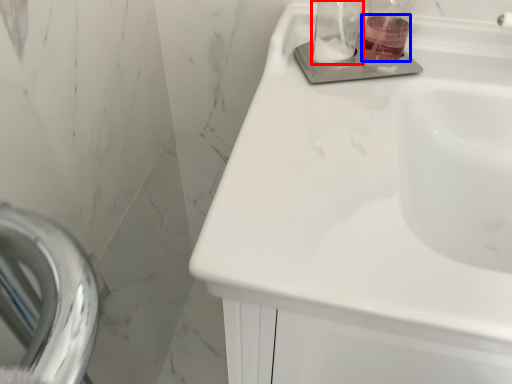
Question: Among these objects, which one is farthest to the camera, glass jar (highlighted by a red box) or liquid (highlighted by a blue box)?

Choices:
 (A) glass jar
 (B) liquid

Answer: (B)